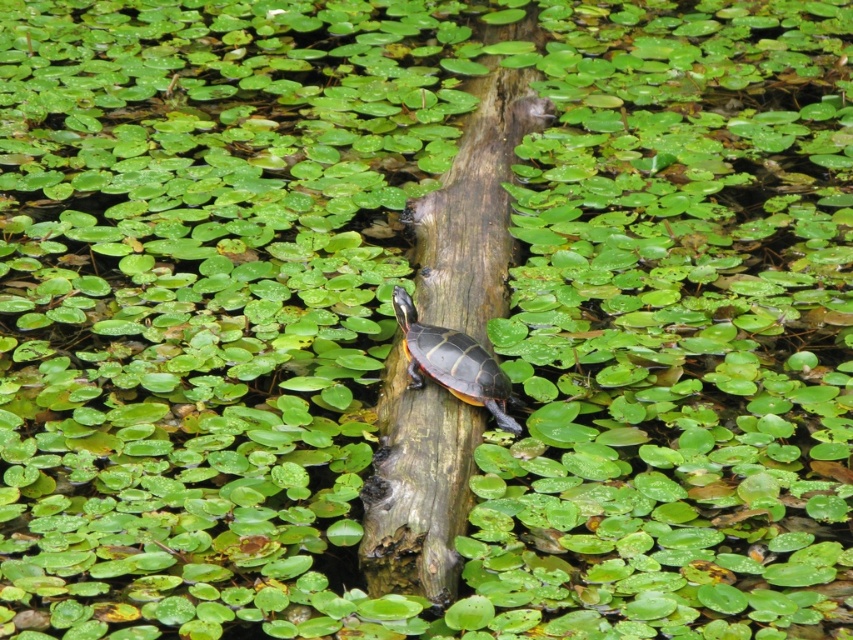
Question: Does brown rough wood at center appear under shiny brown tortoise at center?

Choices:
 (A) no
 (B) yes

Answer: (A)

Question: Which object is farther from the camera taking this photo?

Choices:
 (A) brown rough wood at center
 (B) shiny brown tortoise at center

Answer: (A)

Question: Which of the following is the closest to the observer?

Choices:
 (A) shiny brown tortoise at center
 (B) brown rough wood at center

Answer: (A)

Question: Which point is farther to the camera?

Choices:
 (A) brown rough wood at center
 (B) shiny brown tortoise at center

Answer: (A)

Question: Is brown rough wood at center positioned before shiny brown tortoise at center?

Choices:
 (A) no
 (B) yes

Answer: (A)

Question: Is brown rough wood at center behind shiny brown tortoise at center?

Choices:
 (A) yes
 (B) no

Answer: (A)